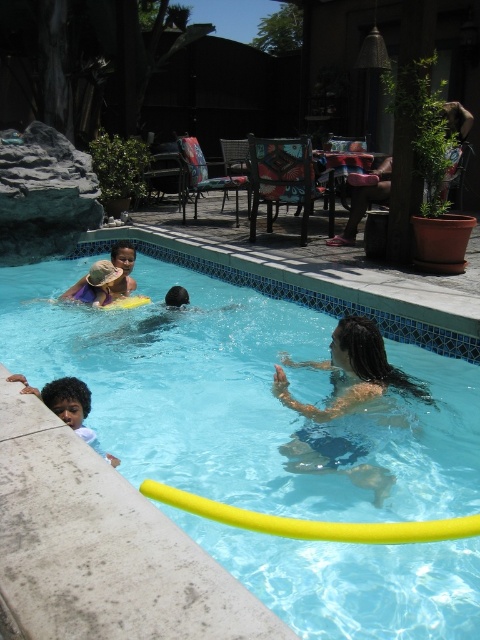
Between point (349, 220) and point (79, 413), which one is positioned in front?

Point (79, 413) is in front.

Does brown leather chair at upper right have a lesser width compared to light brown skin at lower left?

In fact, brown leather chair at upper right might be wider than light brown skin at lower left.

Which is in front, point (364, 186) or point (73, 384)?

Point (73, 384) is in front.

Locate an element on the screen. brown leather chair at upper right is located at coordinates (363, 200).

Is transparent blue water at center behind dark brown hair at center?

That is False.

Who is lower down, transparent blue water at center or dark brown hair at center?

dark brown hair at center is lower down.

Who is more distant from viewer, (364, 451) or (332, 380)?

The point (332, 380) is behind.

Identify the location of transparent blue water at center. (245, 388).

Who is higher up, transparent blue water at center or light brown skin at lower left?

transparent blue water at center is higher up.

The width and height of the screenshot is (480, 640). Identify the location of transparent blue water at center. (245, 388).

Where is `transparent blue water at center`? This screenshot has width=480, height=640. transparent blue water at center is located at coordinates (245, 388).